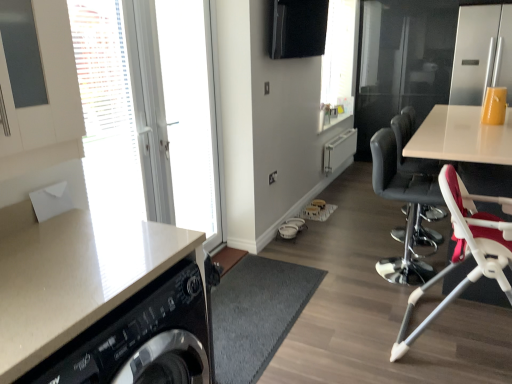
This screenshot has width=512, height=384. Identify the location of free location to the left of white plastic high chair at right. (325, 269).